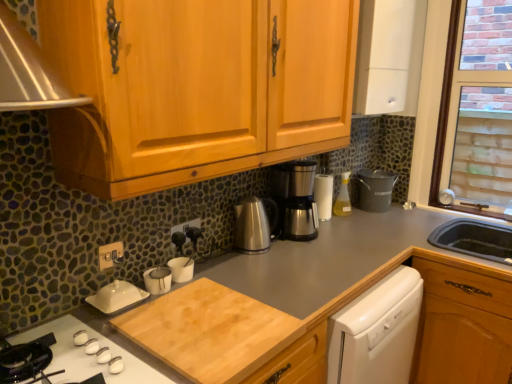
The height and width of the screenshot is (384, 512). Find the location of `empty space that is ontop of natural wood cutting board at lower center (from a real-world perspective)`. empty space that is ontop of natural wood cutting board at lower center (from a real-world perspective) is located at coordinates (202, 327).